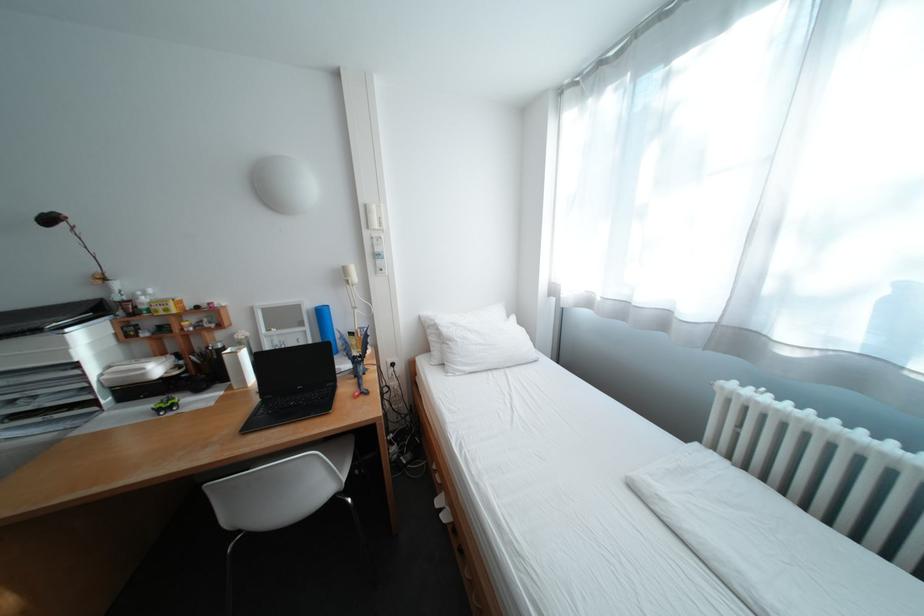
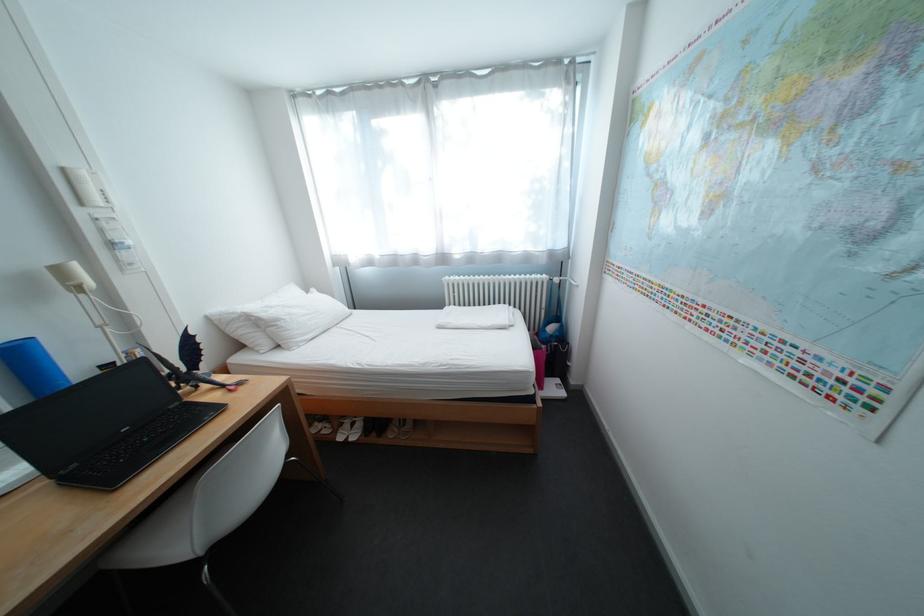
Find the pixel in the second image that matches (x=358, y=270) in the first image.

(71, 272)